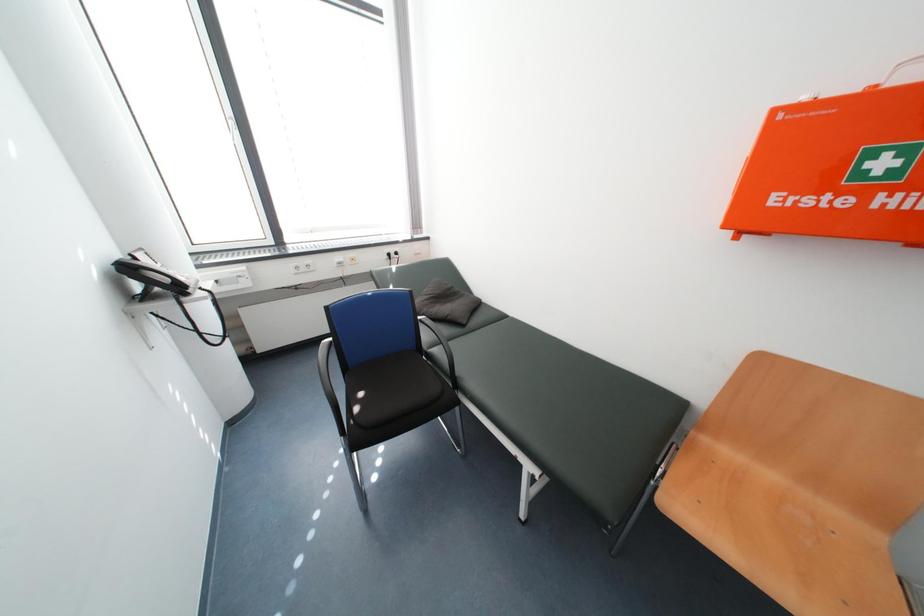
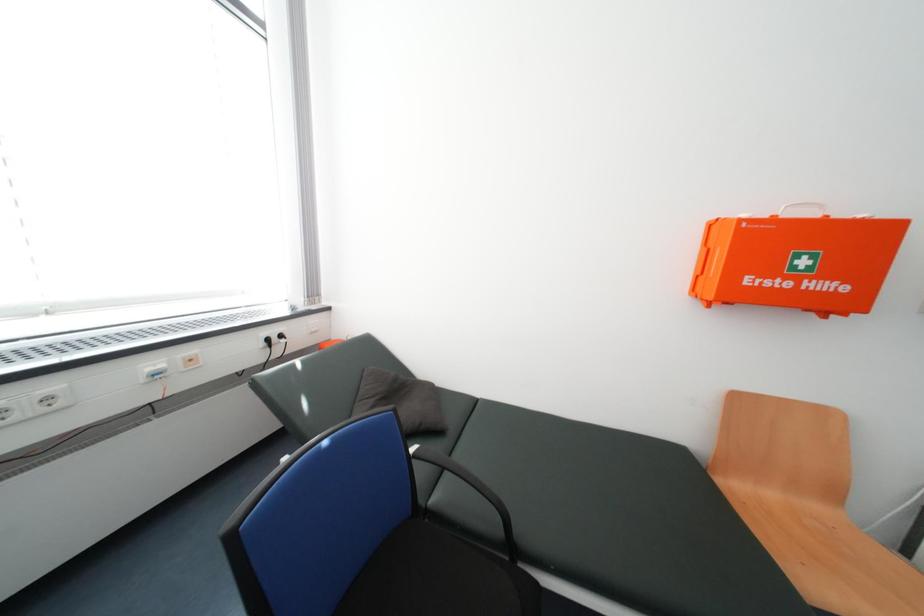
Question: Based on the continuous images, in which direction is the camera rotating? Reply with the corresponding letter.

Choices:
 (A) Left
 (B) Right
 (C) Up
 (D) Down

Answer: (B)